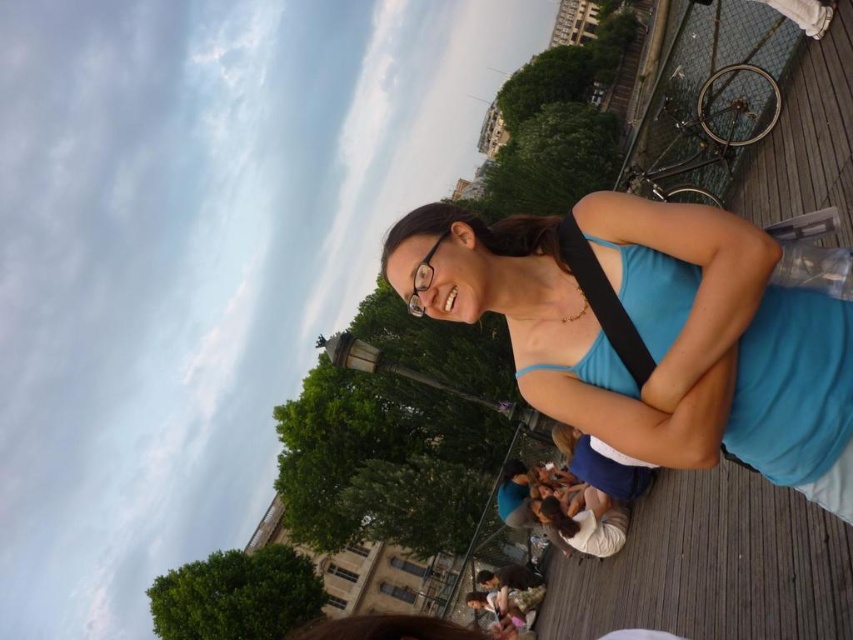
You are a photographer trying to capture the woman wearing the blue fabric tank top at center. Based on the coordinates provided, where should you position your camera to ensure the tank top is in the center of your shot?

The blue fabric tank top at center is located at point coordinates (x=653, y=330), so you should position your camera to aim directly at those coordinates to center the tank top in your shot.

You are a photographer taking a picture of the clear plastic glasses at center. There is a black fabric strap at upper right that might block the view. Is the strap in front of the glasses?

Yes, the black fabric strap at upper right is in front of the clear plastic glasses at center, so it would block the view.

You are a photographer trying to capture the woman in the blue fabric tank top at center. Based on the scene, can you determine the exact coordinates where you should focus your camera to ensure her tank top is centered in the frame?

The blue fabric tank top at center is located at coordinates point (653, 330), so you should focus your camera at those coordinates to center the tank top in the frame.